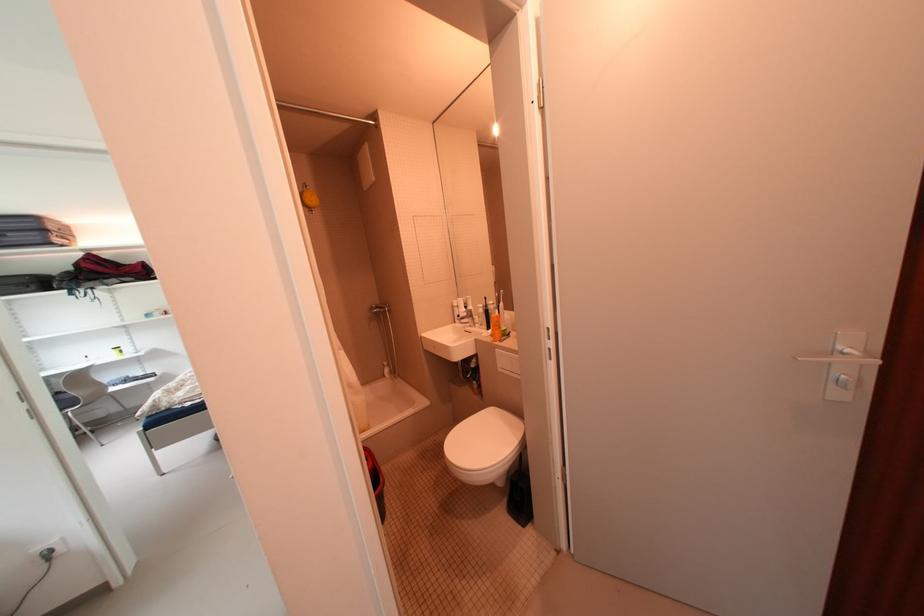
Find where to turn the white door handle. Please return your answer as a coordinate pair (x, y).

(840, 350)